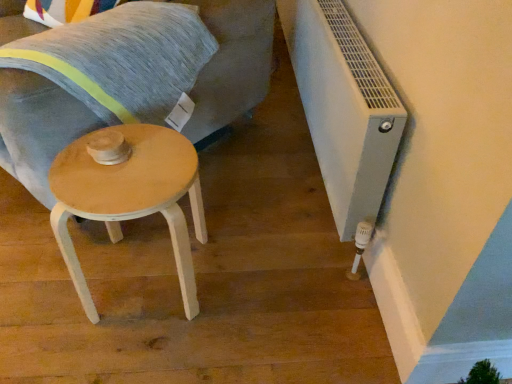
This screenshot has width=512, height=384. What are the coordinates of `spots to the right of light wood/wooden stool at lower left` in the screenshot? It's located at pos(250,288).